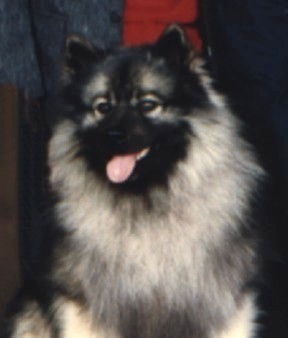
What are the coordinates of `red wall` in the screenshot? It's located at (157, 13).